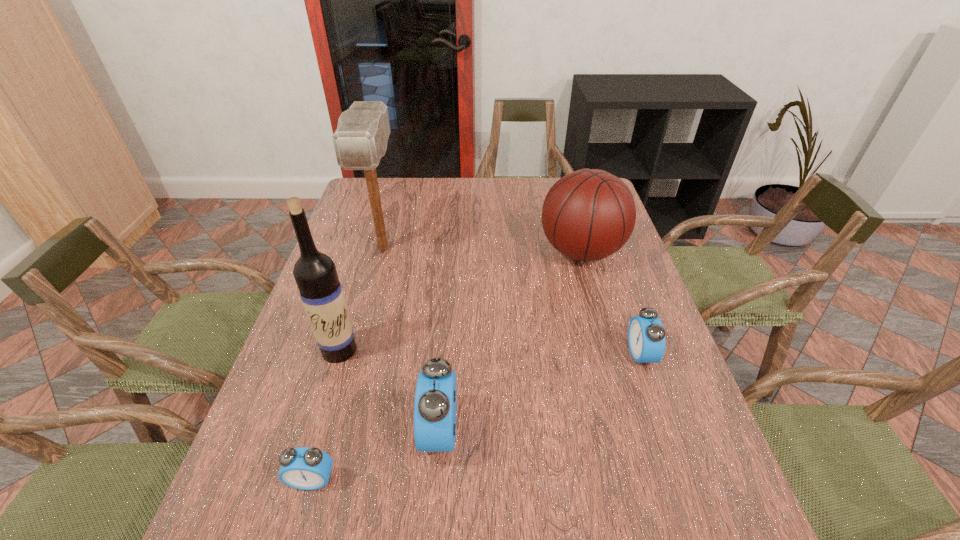
Locate an element on the screen. This screenshot has width=960, height=540. empty location between the rightmost alarm clock and the tallest alarm clock is located at coordinates (540, 393).

Where is `vacant point located between the fourth shortest object and the mallet`? This screenshot has height=540, width=960. vacant point located between the fourth shortest object and the mallet is located at coordinates (482, 250).

Locate an element on the screen. The width and height of the screenshot is (960, 540). free space between the leftmost alarm clock and the second alarm clock from right to left is located at coordinates (376, 456).

Find the location of `free spot between the second nearest alarm clock and the rightmost alarm clock`. free spot between the second nearest alarm clock and the rightmost alarm clock is located at coordinates (540, 393).

Find the location of a particular element. This screenshot has height=540, width=960. vacant area that lies between the fourth shortest object and the wine bottle is located at coordinates (461, 301).

Locate an element on the screen. The height and width of the screenshot is (540, 960). blank region between the wine bottle and the shortest object is located at coordinates (325, 415).

Where is `free spot between the second alarm clock from right to left and the rightmost alarm clock`? The width and height of the screenshot is (960, 540). free spot between the second alarm clock from right to left and the rightmost alarm clock is located at coordinates (540, 393).

Point out which object is positioned as the fourth nearest to the wine bottle. Please provide its 2D coordinates. Your answer should be formatted as a tuple, i.e. [(x, y)], where the tuple contains the x and y coordinates of a point satisfying the conditions above.

[(589, 214)]

The image size is (960, 540). I want to click on object that is the second closest to the third object from right to left, so click(315, 273).

Image resolution: width=960 pixels, height=540 pixels. In order to click on alarm clock identified as the second closest to the wine bottle in this screenshot , I will do `click(304, 468)`.